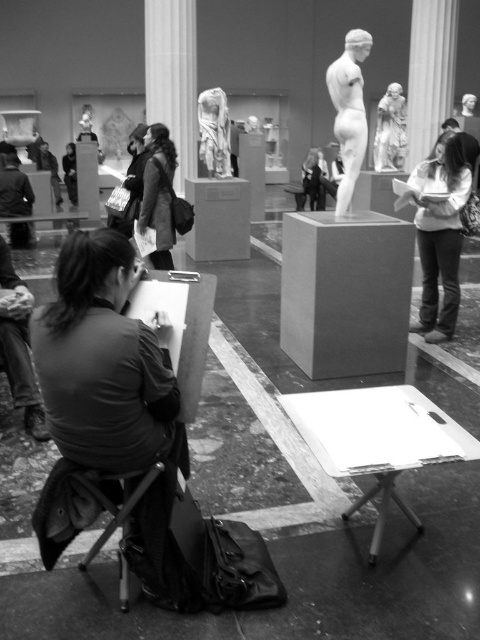
Where is the smooth beige sweater at center located in the image?

The smooth beige sweater at center is located at point [442,228].

Looking at this image, you are an art student visiting the museum. You notice the dark brown leather jacket at upper center and the smooth marble statue at upper right. Which object is positioned more to the left side of the image?

The dark brown leather jacket at upper center is positioned to the left of the smooth marble statue at upper right, so it is more to the left side of the image.

You are an art student who wants to sketch the smooth marble statue at upper right while sitting on the folding chair. The recommended distance for accurate sketching is at least 15 feet. Is the dark brown leather jacket at upper center currently positioned in a way that allows you to maintain this distance?

The dark brown leather jacket at upper center and smooth marble statue at upper right are 15.86 feet apart. Since the recommended distance is at least 15 feet, the distance is sufficient to maintain the required separation.